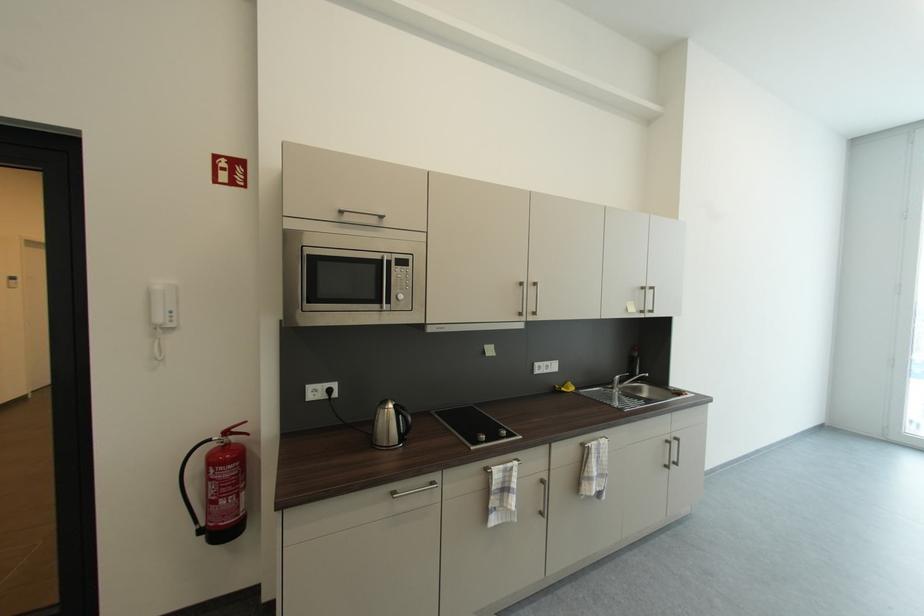
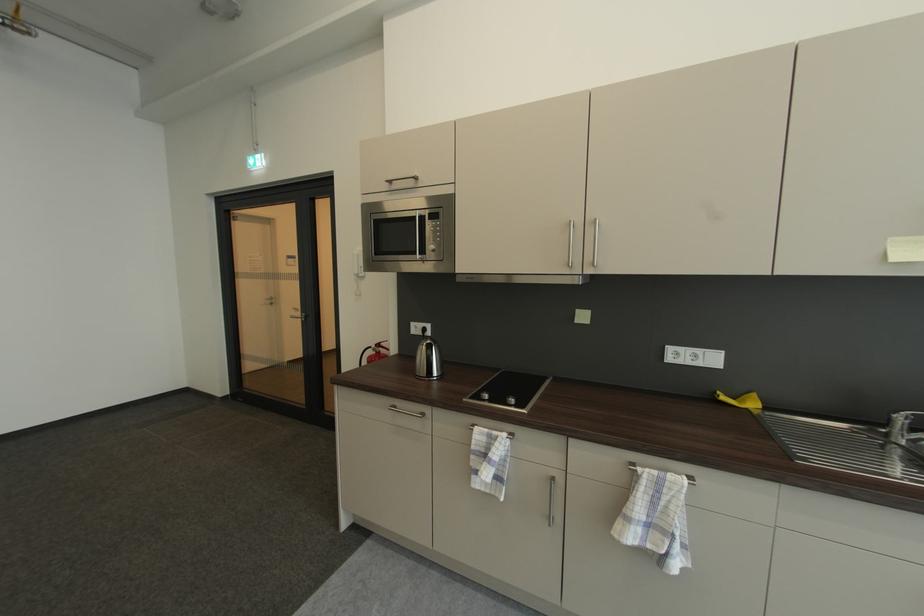
The point at (165, 321) is marked in the first image. Where is the corresponding point in the second image?

(362, 273)